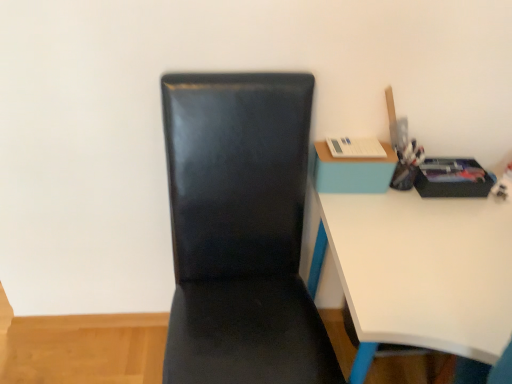
Question: From the image's perspective, would you say white glossy desk at right is shown under black leather chair at center?

Choices:
 (A) yes
 (B) no

Answer: (A)

Question: Is white glossy desk at right outside of black leather chair at center?

Choices:
 (A) yes
 (B) no

Answer: (A)

Question: From a real-world perspective, is white glossy desk at right on top of black leather chair at center?

Choices:
 (A) yes
 (B) no

Answer: (B)

Question: Is black leather chair at center at the back of white glossy desk at right?

Choices:
 (A) yes
 (B) no

Answer: (B)

Question: From the image's perspective, is white glossy desk at right located above black leather chair at center?

Choices:
 (A) yes
 (B) no

Answer: (B)

Question: Relative to white glossy desk at right, is black leather chair at center in front or behind?

Choices:
 (A) behind
 (B) front

Answer: (B)

Question: Is black leather chair at center spatially inside white glossy desk at right, or outside of it?

Choices:
 (A) outside
 (B) inside

Answer: (A)

Question: From the image's perspective, is black leather chair at center located above or below white glossy desk at right?

Choices:
 (A) below
 (B) above

Answer: (B)

Question: In terms of width, does black leather chair at center look wider or thinner when compared to white glossy desk at right?

Choices:
 (A) thin
 (B) wide

Answer: (A)

Question: Considering the positions of point (422, 236) and point (300, 377), is point (422, 236) closer or farther from the camera than point (300, 377)?

Choices:
 (A) farther
 (B) closer

Answer: (A)

Question: Is white glossy desk at right wider or thinner than black leather chair at center?

Choices:
 (A) thin
 (B) wide

Answer: (B)

Question: From the image's perspective, is white glossy desk at right positioned above or below black leather chair at center?

Choices:
 (A) above
 (B) below

Answer: (B)

Question: Would you say white glossy desk at right is to the left or to the right of black leather chair at center in the picture?

Choices:
 (A) right
 (B) left

Answer: (A)

Question: Is point (321, 177) closer or farther from the camera than point (168, 84)?

Choices:
 (A) farther
 (B) closer

Answer: (A)

Question: In terms of height, does blue matte table at upper right look taller or shorter compared to black leather chair at center?

Choices:
 (A) tall
 (B) short

Answer: (B)